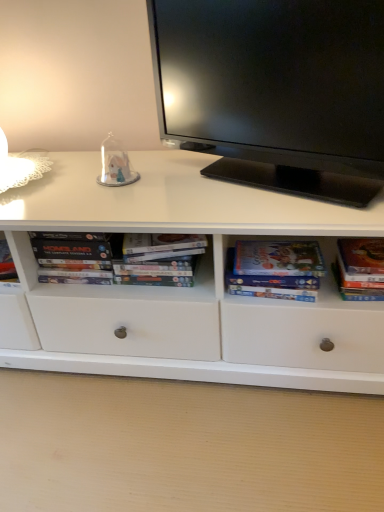
Question: From the image's perspective, is black glossy television at upper center above or below white cardboard books at center?

Choices:
 (A) above
 (B) below

Answer: (A)

Question: Is point (230, 119) closer or farther from the camera than point (44, 261)?

Choices:
 (A) closer
 (B) farther

Answer: (A)

Question: Based on their relative distances, which object is farther from the hardcover book at right, the first paperback book viewed from the right?

Choices:
 (A) white cardboard books at center
 (B) transparent glass dome at center
 (C) black glossy television at upper center
 (D) matte paper book at center right, which is the 1th paperback book from left to right

Answer: (B)

Question: Which object is the farthest from the matte paper book at center right, which is the 1th paperback book from left to right?

Choices:
 (A) white cardboard books at center
 (B) transparent glass dome at center
 (C) black glossy television at upper center
 (D) hardcover book at right, the first paperback book viewed from the right

Answer: (B)